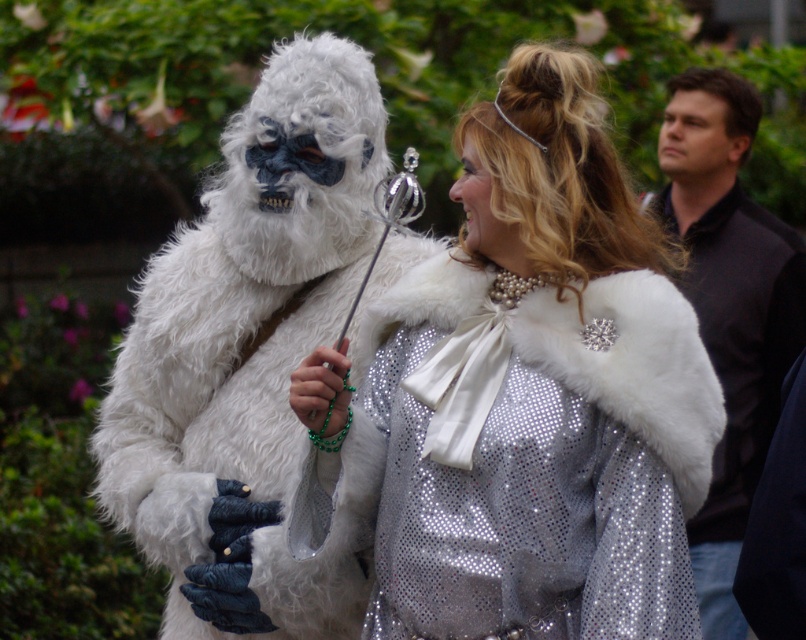
Question: Does white furry coat at center have a greater width compared to dark brown shirt at right?

Choices:
 (A) no
 (B) yes

Answer: (B)

Question: Observing the image, what is the correct spatial positioning of shiny silver cape at center in reference to white furry coat at center?

Choices:
 (A) below
 (B) above

Answer: (A)

Question: Considering the real-world distances, which object is closest to the white furry coat at center?

Choices:
 (A) dark brown shirt at right
 (B) shiny silver cape at center

Answer: (B)

Question: Considering the relative positions of shiny silver cape at center and white furry coat at center in the image provided, where is shiny silver cape at center located with respect to white furry coat at center?

Choices:
 (A) left
 (B) right

Answer: (B)

Question: Which point is farther from the camera taking this photo?

Choices:
 (A) (755, 397)
 (B) (215, 262)
 (C) (584, 440)

Answer: (A)

Question: Which point is farther to the camera?

Choices:
 (A) (584, 508)
 (B) (690, 225)
 (C) (148, 339)

Answer: (B)